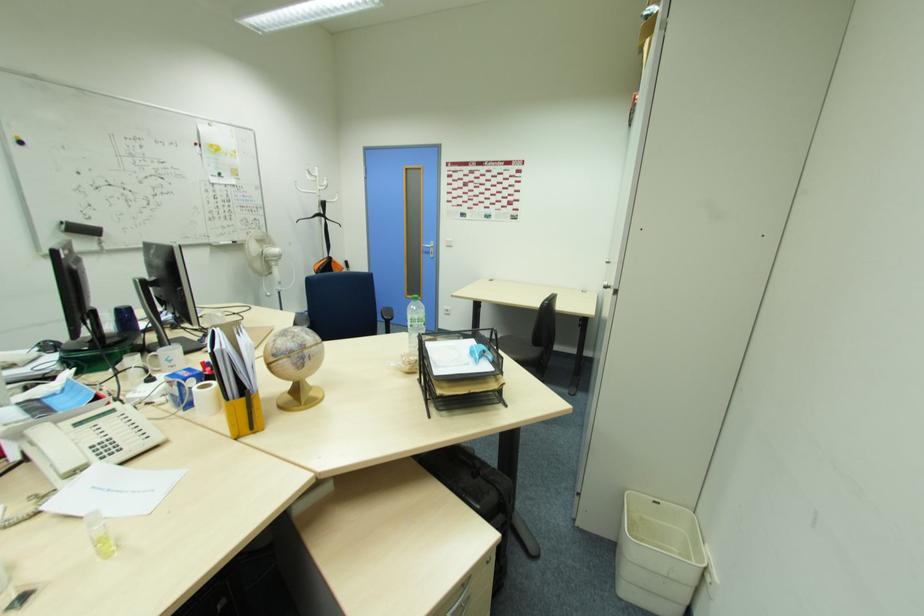
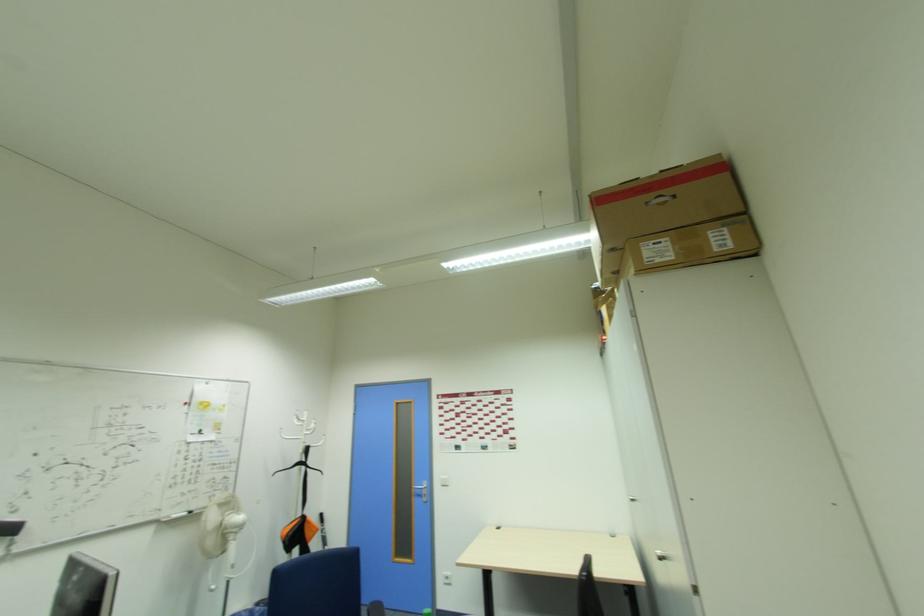
Find the pixel in the second image that matches the point at 430,246 in the first image.

(421, 485)